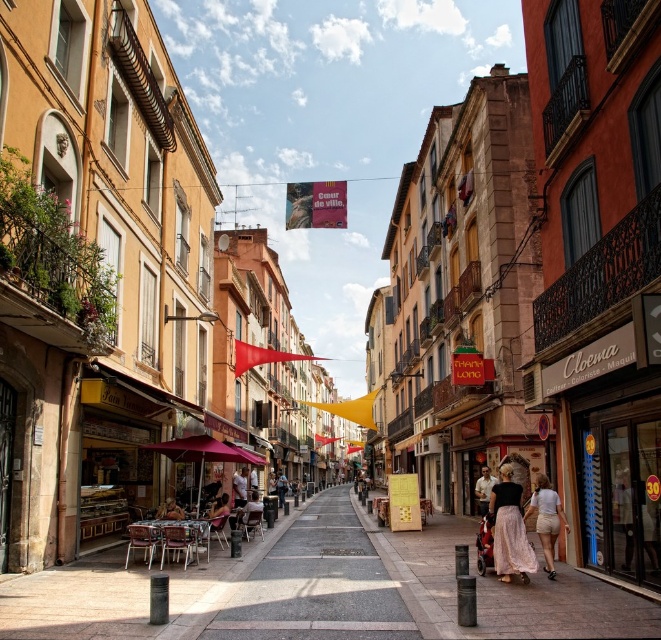
You are a customer looking to sit outside a cafe. You see the pink fabric umbrella at center and the light brown leather chair at center. Which object is taller?

The pink fabric umbrella at center is much taller than the light brown leather chair at center.

You are standing at point (217, 509) in the scene. What object is located at that exact point?

The light brown wooden chair at center is located at point (217, 509).

You are a tourist standing on the street and want to take a photo of the pink fabric umbrella at center. Considering your camera can focus up to 40 meters, will you need to move closer to capture it clearly?

The pink fabric umbrella at center is 41.63 meters from the viewer. Since the camera can only focus up to 40 meters, you need to move closer to ensure it is within the focus range.